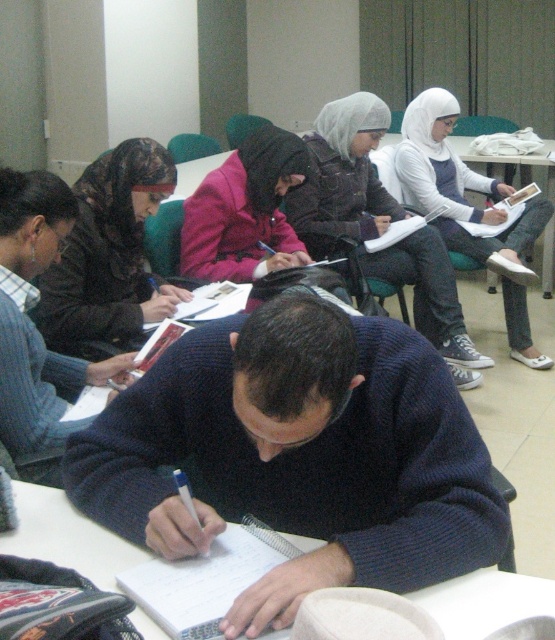
Question: From the image, what is the correct spatial relationship of matte black hijab at upper left in relation to pink fabric hijab at center?

Choices:
 (A) left
 (B) right

Answer: (A)

Question: Estimate the real-world distances between objects in this image. Which object is farther from the white knit sweater at upper center?

Choices:
 (A) white knit sweater at center
 (B) white paper at center

Answer: (B)

Question: Considering the real-world distances, which object is farthest from the white knit sweater at upper center?

Choices:
 (A) pink fabric hijab at center
 (B) white knit sweater at center

Answer: (A)

Question: Is dark blue sweater at center to the right of white knit sweater at upper center from the viewer's perspective?

Choices:
 (A) no
 (B) yes

Answer: (A)

Question: Is dark blue sweater at center thinner than white paper at center?

Choices:
 (A) no
 (B) yes

Answer: (A)

Question: Which point appears closest to the camera in this image?

Choices:
 (A) (133, 237)
 (B) (375, 202)
 (C) (460, 444)

Answer: (C)